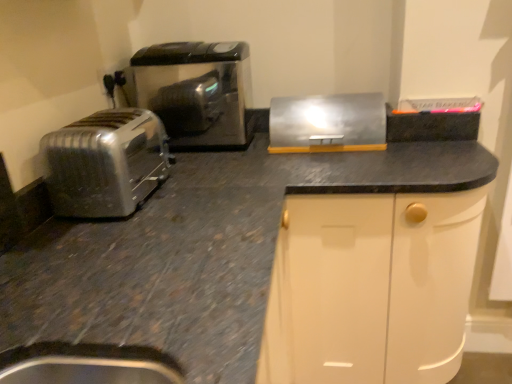
Question: Is satin silver toaster at left positioned before metallic silver breadbox at upper right?

Choices:
 (A) yes
 (B) no

Answer: (A)

Question: Can you confirm if satin silver toaster at left is shorter than metallic silver breadbox at upper right?

Choices:
 (A) yes
 (B) no

Answer: (B)

Question: Is satin silver toaster at left taller than metallic silver breadbox at upper right?

Choices:
 (A) no
 (B) yes

Answer: (B)

Question: Does satin silver toaster at left have a larger size compared to metallic silver breadbox at upper right?

Choices:
 (A) yes
 (B) no

Answer: (A)

Question: Does satin silver toaster at left lie behind metallic silver breadbox at upper right?

Choices:
 (A) yes
 (B) no

Answer: (B)

Question: Would you say metallic silver breadbox at upper right is to the left or to the right of matte black outlet at upper left in the picture?

Choices:
 (A) right
 (B) left

Answer: (A)

Question: From the image's perspective, is metallic silver breadbox at upper right above or below matte black outlet at upper left?

Choices:
 (A) above
 (B) below

Answer: (B)

Question: In terms of width, does metallic silver breadbox at upper right look wider or thinner when compared to matte black outlet at upper left?

Choices:
 (A) thin
 (B) wide

Answer: (B)

Question: Is metallic silver breadbox at upper right in front of or behind matte black outlet at upper left in the image?

Choices:
 (A) behind
 (B) front

Answer: (B)

Question: Considering their positions, is satin black toaster at left located in front of or behind metallic silver breadbox at upper right?

Choices:
 (A) behind
 (B) front

Answer: (A)

Question: From the image's perspective, is satin black toaster at left above or below metallic silver breadbox at upper right?

Choices:
 (A) below
 (B) above

Answer: (B)

Question: Based on their positions, is satin black toaster at left located to the left or right of metallic silver breadbox at upper right?

Choices:
 (A) right
 (B) left

Answer: (B)

Question: In terms of width, does satin black toaster at left look wider or thinner when compared to metallic silver breadbox at upper right?

Choices:
 (A) thin
 (B) wide

Answer: (B)

Question: Does point (x=120, y=72) appear closer or farther from the camera than point (x=343, y=150)?

Choices:
 (A) closer
 (B) farther

Answer: (B)

Question: In terms of height, does matte black outlet at upper left look taller or shorter compared to metallic silver breadbox at upper right?

Choices:
 (A) tall
 (B) short

Answer: (B)